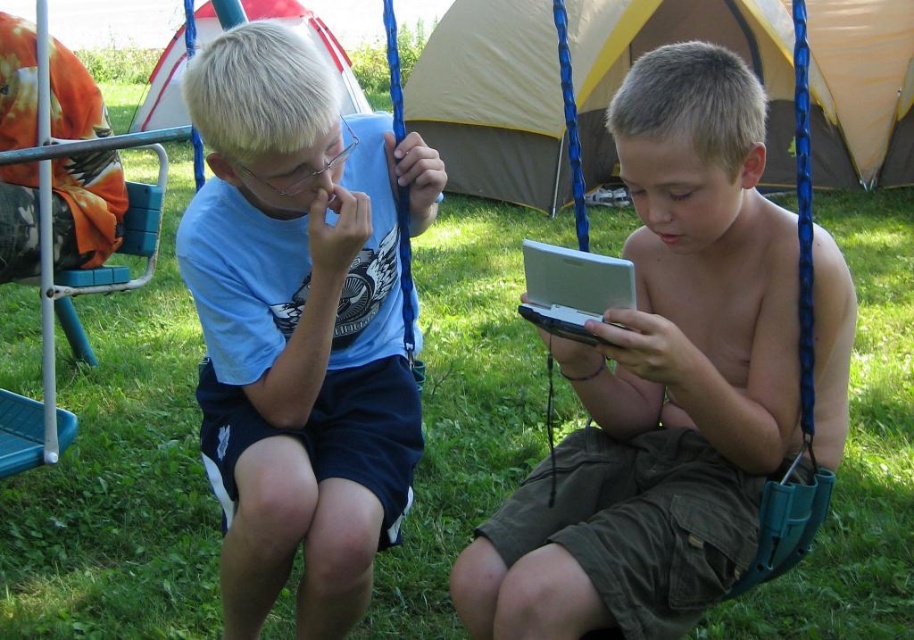
Question: Can you confirm if red and white striped tent at upper left is positioned to the right of white matte handheld device at right?

Choices:
 (A) yes
 (B) no

Answer: (B)

Question: Which point is closer to the camera taking this photo?

Choices:
 (A) tap(604, 269)
 (B) tap(183, 124)

Answer: (A)

Question: Can you confirm if matte silver handheld device at center is positioned to the left of tan canvas tent at center?

Choices:
 (A) yes
 (B) no

Answer: (B)

Question: Which point is closer to the camera taking this photo?

Choices:
 (A) (325, 333)
 (B) (245, 4)
 (C) (633, 396)

Answer: (A)

Question: Does blue matte shirt at left appear over white matte handheld device at right?

Choices:
 (A) yes
 (B) no

Answer: (B)

Question: Which of the following is the closest to the observer?

Choices:
 (A) matte silver handheld device at center
 (B) blue matte shirt at left
 (C) red and white striped tent at upper left

Answer: (A)